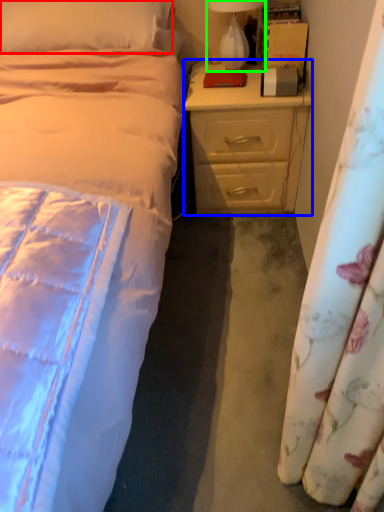
Question: Which is nearer to the pillow (highlighted by a red box)? nightstand (highlighted by a blue box) or lamp (highlighted by a green box).

Choices:
 (A) nightstand
 (B) lamp

Answer: (B)